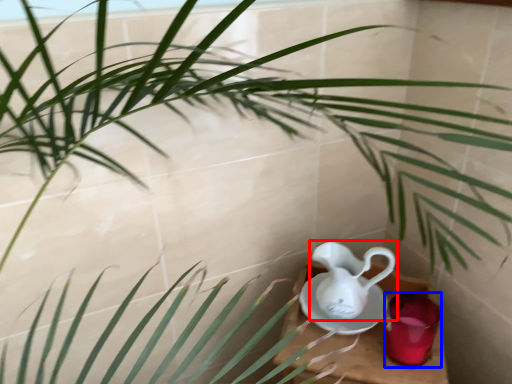
Question: Among these objects, which one is nearest to the camera, jug (highlighted by a red box) or tableware (highlighted by a blue box)?

Choices:
 (A) jug
 (B) tableware

Answer: (A)